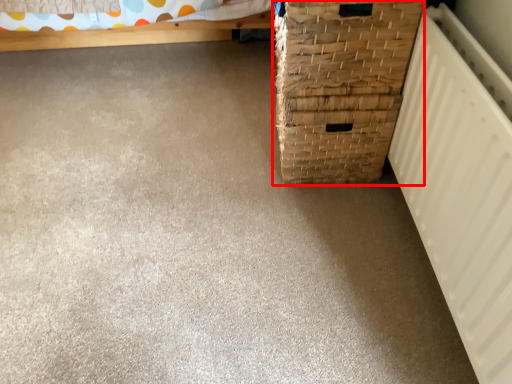
Question: Considering the relative positions of basket container (annotated by the red box) and radiator in the image provided, where is basket container (annotated by the red box) located with respect to the staircase?

Choices:
 (A) right
 (B) left

Answer: (B)